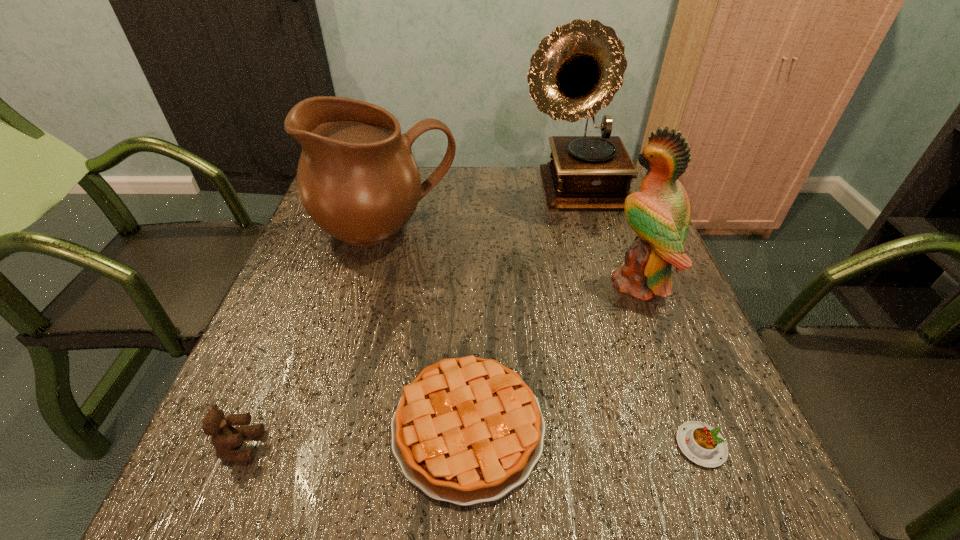
Locate an element on the screen. The height and width of the screenshot is (540, 960). the second closest object to the cream pitcher is located at coordinates click(467, 430).

Where is `blank area in the image that satisfies the following two spatial constraints: 1. on the horn of the record player; 2. on the face of the third shortest object`? blank area in the image that satisfies the following two spatial constraints: 1. on the horn of the record player; 2. on the face of the third shortest object is located at coordinates (652, 446).

This screenshot has height=540, width=960. Find the location of `vacant space that satisfies the following two spatial constraints: 1. on the front-facing side of the pudding; 2. on the left side of the parrot`. vacant space that satisfies the following two spatial constraints: 1. on the front-facing side of the pudding; 2. on the left side of the parrot is located at coordinates (701, 445).

The height and width of the screenshot is (540, 960). Find the location of `vacant space that satisfies the following two spatial constraints: 1. on the horn of the pudding; 2. on the left side of the record player`. vacant space that satisfies the following two spatial constraints: 1. on the horn of the pudding; 2. on the left side of the record player is located at coordinates (652, 445).

Image resolution: width=960 pixels, height=540 pixels. In order to click on free location that satisfies the following two spatial constraints: 1. at the spout of the shortest object; 2. on the left side of the cream pitcher in this screenshot , I will do `click(331, 445)`.

What are the coordinates of `vacant space that satisfies the following two spatial constraints: 1. on the front side of the shortest object; 2. on the face of the fourth tallest object` in the screenshot? It's located at (701, 446).

The width and height of the screenshot is (960, 540). What are the coordinates of `vacant space that satisfies the following two spatial constraints: 1. on the horn of the tallest object; 2. on the left side of the shortest object` in the screenshot? It's located at (652, 445).